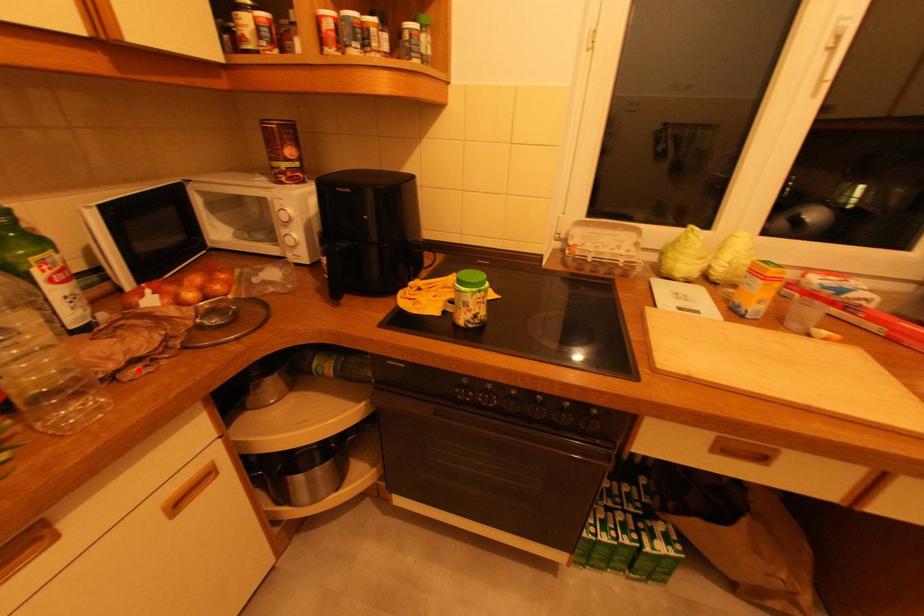
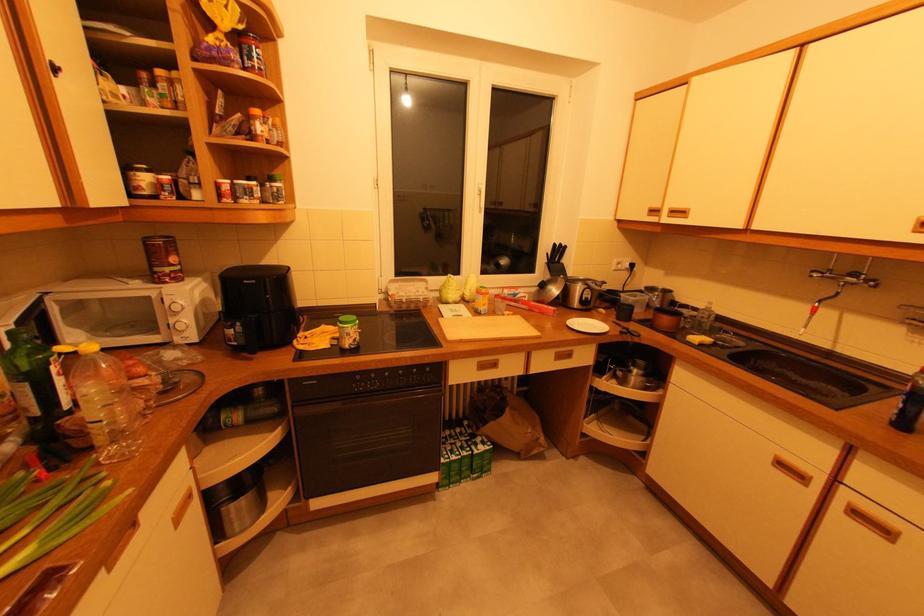
Locate, in the second image, the point that corresponds to the highlighted location in the first image.

(140, 423)